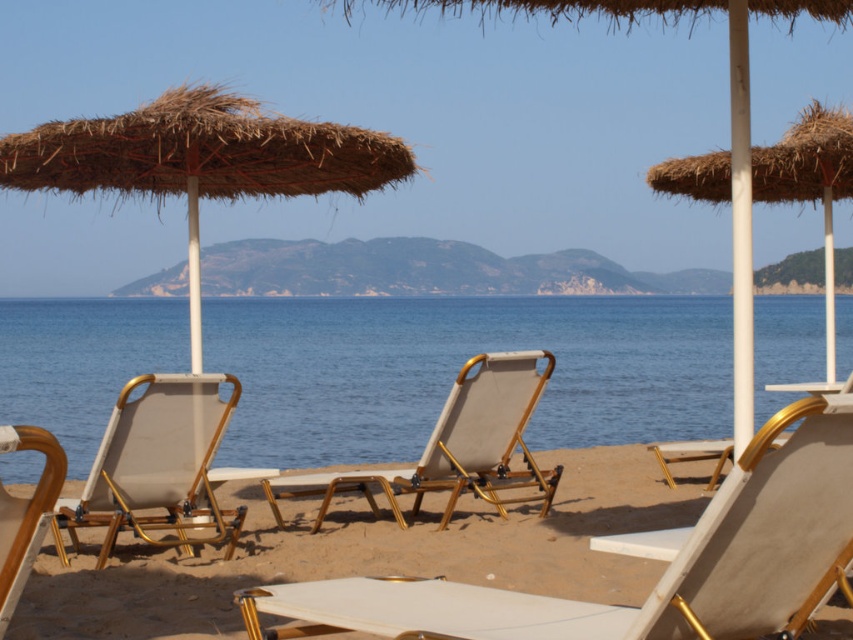
You are a photographer planning to take a wide shot of the beach scene. You notice the blue water at center and the gold metallic beach chair at center. Which object would occupy more space in your photo?

The blue water at center is bigger than the gold metallic beach chair at center, so it would occupy more space in the photo.

You are a beachgoer who wants to sit under the natural straw umbrella at left but need to pass by the beige fabric beach chair at left. Which object will you encounter first as you approach from the sand?

The natural straw umbrella at left is closer to you, so you will encounter it before the beige fabric beach chair at left as you approach from the sand.